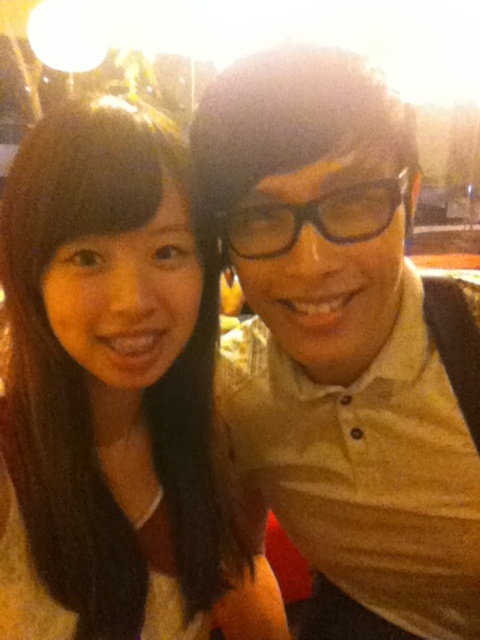
You are taking a photo of two people in a casual indoor setting. You want to place a small decoration between them such that it appears closer to the camera than both of them. Given their positions at point (147, 337) and point (289, 212), where should you place the decoration?

To place the decoration closer to the camera than both individuals, position it at a point with a z coordinate less than both points. Since point (147, 337) is closer to the camera than point (289, 212), the decoration must be placed in front of point (147, 337) along the z axis.

You are a photographer adjusting the lighting for a portrait. You notice the matte beige polo shirt at center and the black plastic glasses at center. Which object should you focus on first if you want to ensure the glasses are sharp, given that the camera can only focus on one area at a time?

The matte beige polo shirt at center is below the black plastic glasses at center, so focusing on the black plastic glasses at center first would ensure they are sharp since they are positioned higher up.